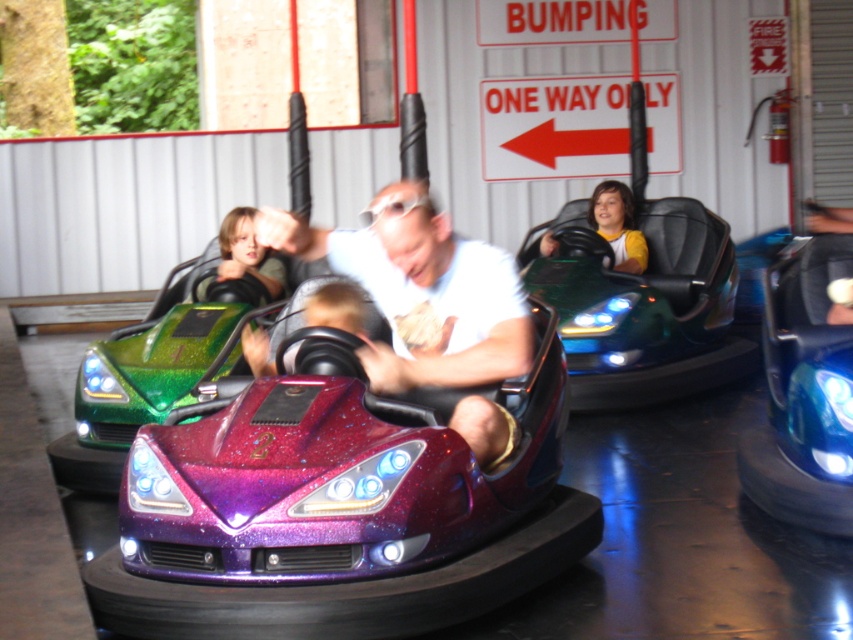
Question: Which point is closer to the camera?

Choices:
 (A) yellow cotton shirt at center
 (B) smooth skin child at center

Answer: (B)

Question: Is shiny metallic car at center bigger than yellow cotton shirt at center?

Choices:
 (A) yes
 (B) no

Answer: (A)

Question: Estimate the real-world distances between objects in this image. Which object is farther from the smooth skin child at center?

Choices:
 (A) shiny metallic car at center
 (B) yellow cotton shirt at center

Answer: (B)

Question: Is shiny metallic car at center positioned behind smooth skin child at center?

Choices:
 (A) no
 (B) yes

Answer: (A)

Question: Can you confirm if smooth skin child at center is bigger than yellow cotton shirt at center?

Choices:
 (A) no
 (B) yes

Answer: (A)

Question: Which point is farther from the camera taking this photo?

Choices:
 (A) (514, 316)
 (B) (254, 260)
 (C) (624, 234)

Answer: (C)